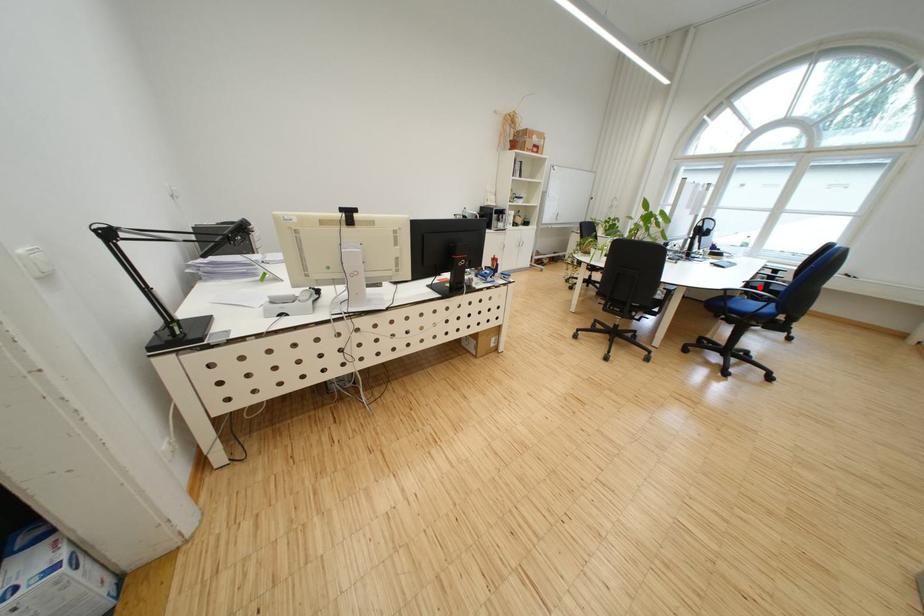
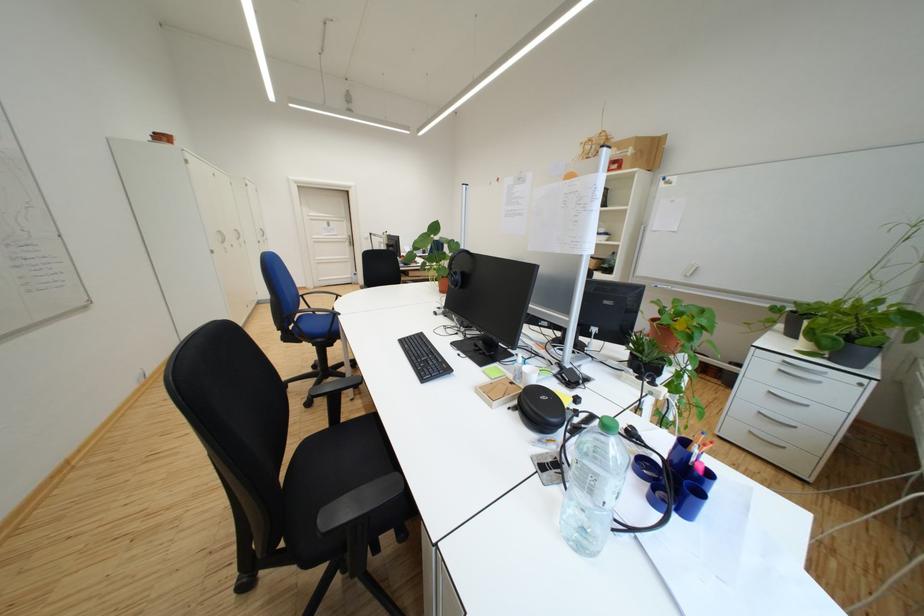
Question: I am providing you with two images of the same scene from different viewpoints. A red point is marked on the first image. Can you still see the location of the red point in image 2?

Choices:
 (A) Yes
 (B) No

Answer: (B)